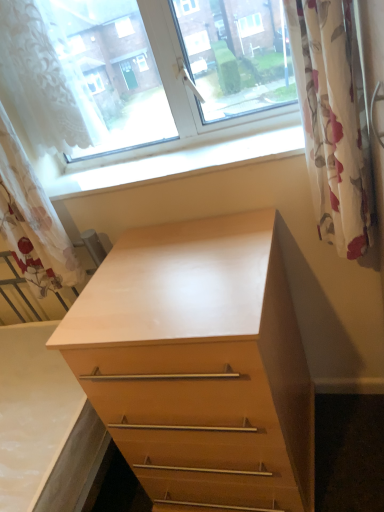
The image size is (384, 512). Find the location of `vacant space underneath white lace curtain at upper left (from a real-world perspective)`. vacant space underneath white lace curtain at upper left (from a real-world perspective) is located at coordinates (96, 172).